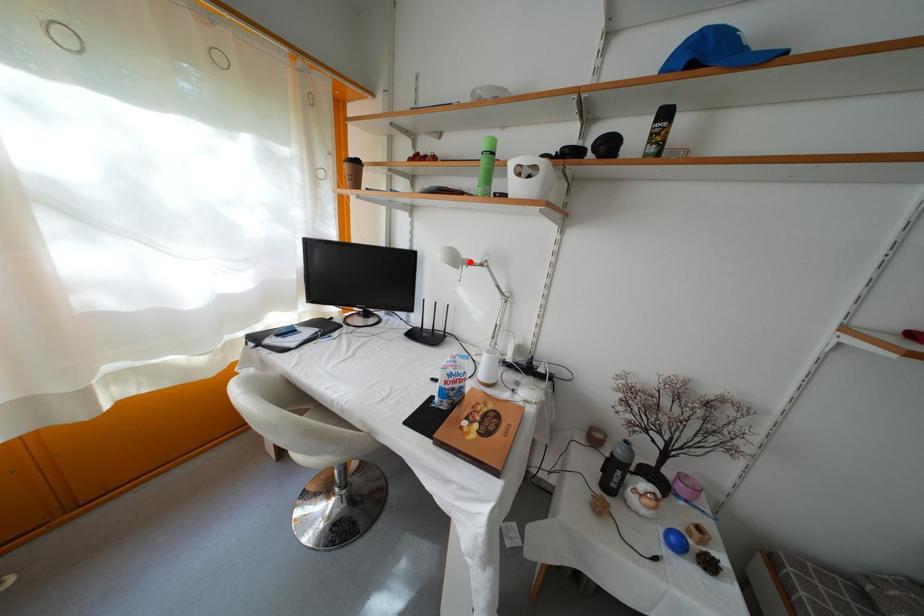
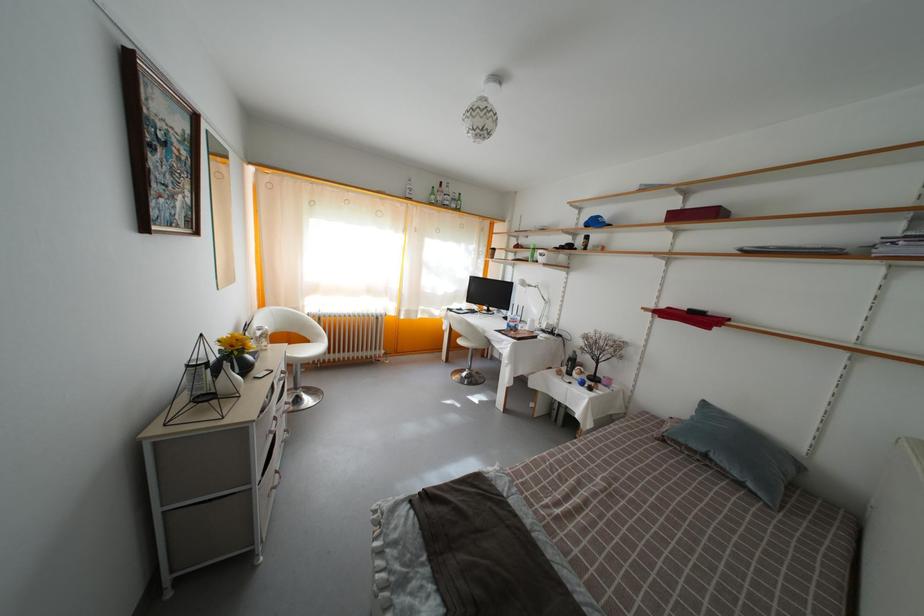
Locate, in the second image, the point that corresponds to the highlighted location in the first image.

(533, 289)